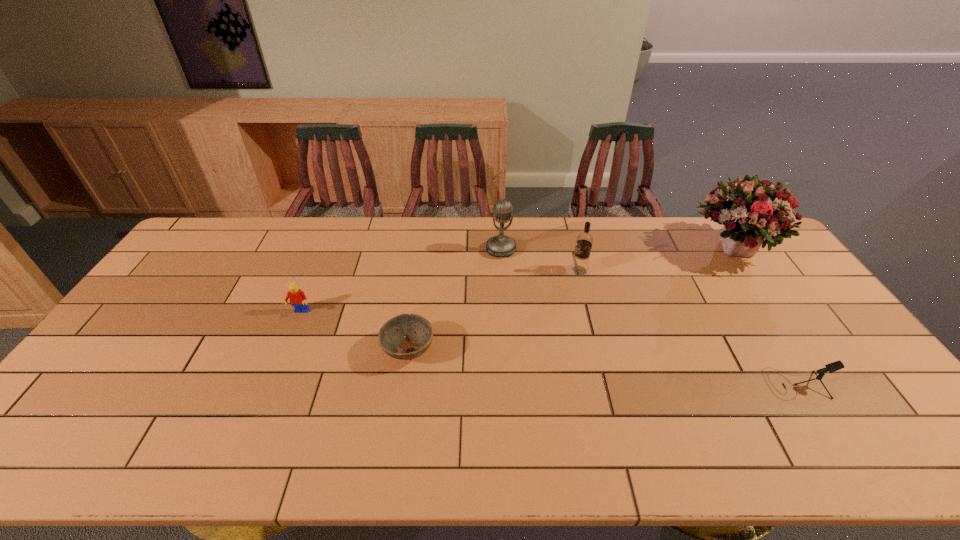
I want to click on blank area located 0.090m on the front of the bouquet, so click(x=761, y=298).

Locate an element on the screen. vacant space located 0.070m on the front-facing side of the taller microphone is located at coordinates (502, 273).

Find the location of a particular element. This screenshot has height=540, width=960. vacant region located 0.340m on the label of the vodka is located at coordinates (467, 271).

Find the location of `vacant area situated 0.270m on the label of the vodka`. vacant area situated 0.270m on the label of the vodka is located at coordinates (488, 271).

Image resolution: width=960 pixels, height=540 pixels. What are the coordinates of `vacant space situated 0.370m on the label of the vodka` in the screenshot? It's located at (458, 271).

This screenshot has height=540, width=960. Find the location of `vacant area located 0.270m on the front-facing side of the fourth farthest object`. vacant area located 0.270m on the front-facing side of the fourth farthest object is located at coordinates coord(265,396).

This screenshot has height=540, width=960. What are the coordinates of `vacant area located 0.380m on the stand of the shorter microphone` in the screenshot? It's located at (618, 384).

Find the location of `vacant space located on the stand of the shorter microphone`. vacant space located on the stand of the shorter microphone is located at coordinates (634, 384).

Find the location of a particular element. This screenshot has height=540, width=960. free space located on the stand of the shorter microphone is located at coordinates (641, 384).

Identify the location of vacant area situated 0.080m on the right of the fifth object from right to left. The width and height of the screenshot is (960, 540). (464, 350).